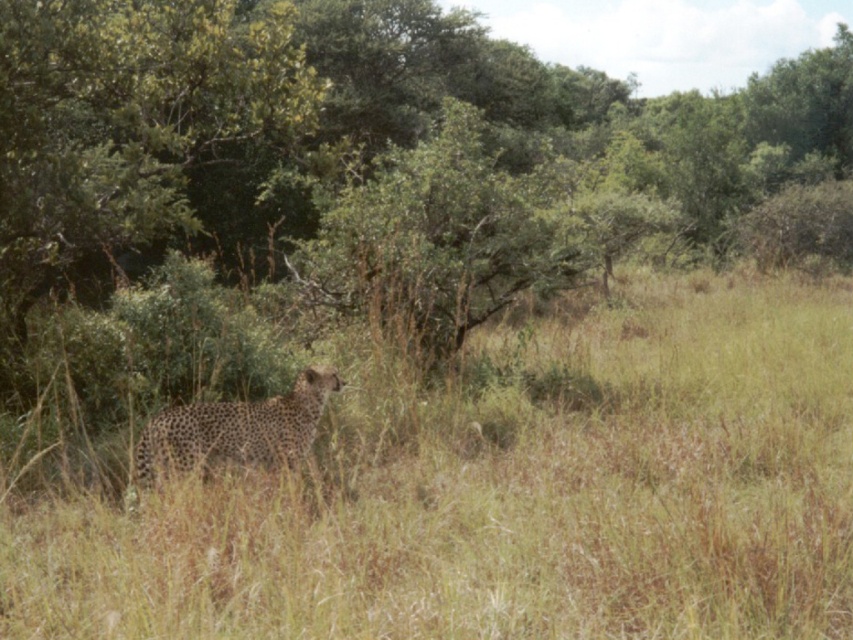
In the scene shown: You are a wildlife photographer aiming to capture a clear shot of the brown dry grass at center. You are currently positioned 4 meters away from the grass. Can you adjust your position to get closer without exceeding the minimum safe distance of 3.9 meters? Please explain.

The brown dry grass at center is 3.97 meters away from the camera. Since you are currently 4 meters away, you need to move 0.03 meters closer to reach the minimum safe distance of 3.9 meters. Moving 0.03 meters closer would place you at 3.97 meters minus 0.03 meters equals 3.94 meters, which is still within the safe distance requirement. Therefore, you can move closer by 0.03 meters to achieve the desired shot without violating the safety guideline.

You are an observer in the savanna and see the brown dry grass at center and the spotted fur cheetah at center. Which object is located to the right side of the other?

The brown dry grass at center is to the right of the spotted fur cheetah at center according to the description.